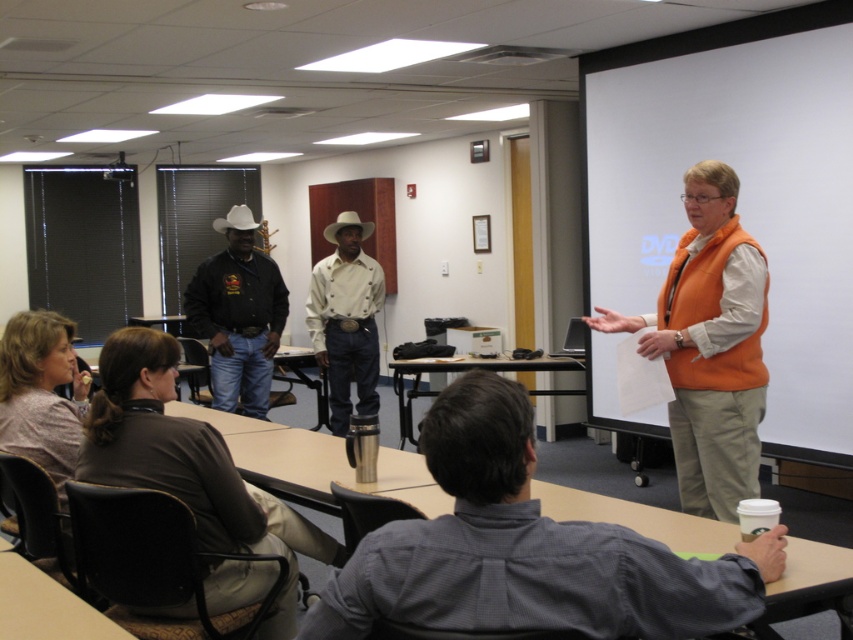
You are standing in the conference room and want to locate the gray checkered shirt at center. According to the coordinates provided, where should you look?

The gray checkered shirt at center is located at point coordinates of (526,548).

You are organizing a photo shoot and need to ensure that the gray checkered shirt at center and the patterned fabric shirt at lower left are both visible in the frame. Based on their positions, which shirt should you position closer to the camera to ensure both are fully visible without cropping?

The gray checkered shirt at center might be wider than the patterned fabric shirt at lower left, so positioning the patterned fabric shirt at lower left closer to the camera would help ensure both shirts are fully visible without cropping.

You are an attendee at the conference and want to hand a document to the presenter. You notice the black leather jacket at center and the beige cotton shirt at center. Which one is closer to you?

The black leather jacket at center is closer to you since it is in front of the beige cotton shirt at center.